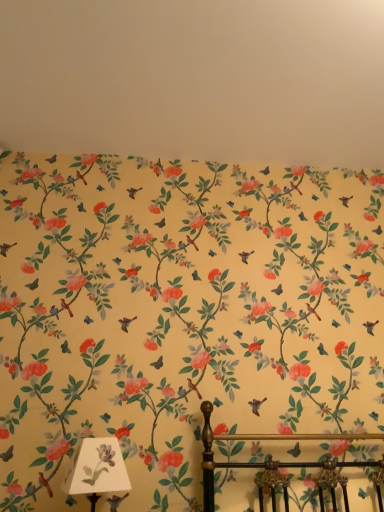
In order to face yellow floral wallpaper at upper center, should I rotate leftwards or rightwards?

Rotate right and turn 3.535 degrees.

Describe the element at coordinates (196, 80) in the screenshot. The height and width of the screenshot is (512, 384). I see `yellow floral wallpaper at upper center` at that location.

Locate an element on the screen. The width and height of the screenshot is (384, 512). yellow floral wallpaper at upper center is located at coordinates (196, 80).

Find the location of `white paper shade at lower left`. white paper shade at lower left is located at coordinates (97, 469).

The width and height of the screenshot is (384, 512). Describe the element at coordinates (97, 469) in the screenshot. I see `white paper shade at lower left` at that location.

The width and height of the screenshot is (384, 512). I want to click on yellow floral wallpaper at upper center, so click(196, 80).

Is white paper shade at lower left to the right of yellow floral wallpaper at upper center from the viewer's perspective?

No.

Considering their positions, is white paper shade at lower left located in front of or behind yellow floral wallpaper at upper center?

Visually, white paper shade at lower left is located in front of yellow floral wallpaper at upper center.

Considering the points (101, 446) and (221, 36), which point is behind, point (101, 446) or point (221, 36)?

Point (221, 36)

From the image's perspective, which one is positioned lower, white paper shade at lower left or yellow floral wallpaper at upper center?

white paper shade at lower left is shown below in the image.

From a real-world perspective, which object rests below the other?

white paper shade at lower left.

Considering the relative sizes of white paper shade at lower left and yellow floral wallpaper at upper center in the image provided, is white paper shade at lower left wider than yellow floral wallpaper at upper center?

In fact, white paper shade at lower left might be narrower than yellow floral wallpaper at upper center.

Which of these two, white paper shade at lower left or yellow floral wallpaper at upper center, stands shorter?

With less height is yellow floral wallpaper at upper center.

Who is bigger, white paper shade at lower left or yellow floral wallpaper at upper center?

yellow floral wallpaper at upper center is bigger.

In the scene shown: Is yellow floral wallpaper at upper center surrounded by white paper shade at lower left?

No, yellow floral wallpaper at upper center is not a part of white paper shade at lower left.

Is white paper shade at lower left in contact with yellow floral wallpaper at upper center?

No, white paper shade at lower left is not with yellow floral wallpaper at upper center.

Is white paper shade at lower left facing towards yellow floral wallpaper at upper center?

No, white paper shade at lower left is not aimed at yellow floral wallpaper at upper center.

In the scene shown: How different are the orientations of white paper shade at lower left and yellow floral wallpaper at upper center in degrees?

white paper shade at lower left and yellow floral wallpaper at upper center are facing 2.96 degrees away from each other.

Find the location of a particular element. table lamp lying below the yellow floral wallpaper at upper center (from the image's perspective) is located at coordinates (97, 469).

Is yellow floral wallpaper at upper center to the left of white paper shade at lower left from the viewer's perspective?

No.

Is the depth of yellow floral wallpaper at upper center greater than that of white paper shade at lower left?

Yes, it is behind white paper shade at lower left.

Which point is more forward, (382, 18) or (85, 461)?

The point (85, 461) is closer.

From the image's perspective, is yellow floral wallpaper at upper center located beneath white paper shade at lower left?

Incorrect, from the image's perspective, yellow floral wallpaper at upper center is higher than white paper shade at lower left.

From a real-world perspective, is yellow floral wallpaper at upper center physically located above or below white paper shade at lower left?

From a real-world perspective, yellow floral wallpaper at upper center is physically above white paper shade at lower left.

Consider the image. Looking at their sizes, would you say yellow floral wallpaper at upper center is wider or thinner than white paper shade at lower left?

Clearly, yellow floral wallpaper at upper center has more width compared to white paper shade at lower left.

Which of these two, yellow floral wallpaper at upper center or white paper shade at lower left, stands taller?

white paper shade at lower left.

Who is smaller, yellow floral wallpaper at upper center or white paper shade at lower left?

With smaller size is white paper shade at lower left.

Is yellow floral wallpaper at upper center inside or outside of white paper shade at lower left?

yellow floral wallpaper at upper center is located beyond the bounds of white paper shade at lower left.

Are yellow floral wallpaper at upper center and white paper shade at lower left far apart?

yellow floral wallpaper at upper center is far away from white paper shade at lower left.

Is yellow floral wallpaper at upper center looking in the opposite direction of white paper shade at lower left?

No, yellow floral wallpaper at upper center is not facing away from white paper shade at lower left.

Can you tell me how much yellow floral wallpaper at upper center and white paper shade at lower left differ in facing direction?

The angle between the facing direction of yellow floral wallpaper at upper center and the facing direction of white paper shade at lower left is 2.96 degrees.

Measure the distance between yellow floral wallpaper at upper center and white paper shade at lower left.

yellow floral wallpaper at upper center is 1.40 meters away from white paper shade at lower left.

This screenshot has width=384, height=512. Find the location of `table lamp in front of the yellow floral wallpaper at upper center`. table lamp in front of the yellow floral wallpaper at upper center is located at coordinates (97, 469).

This screenshot has width=384, height=512. What are the coordinates of `backdrop above the white paper shade at lower left (from the image's perspective)` in the screenshot? It's located at (196, 80).

Find the location of a particular element. The height and width of the screenshot is (512, 384). backdrop behind the white paper shade at lower left is located at coordinates (196, 80).